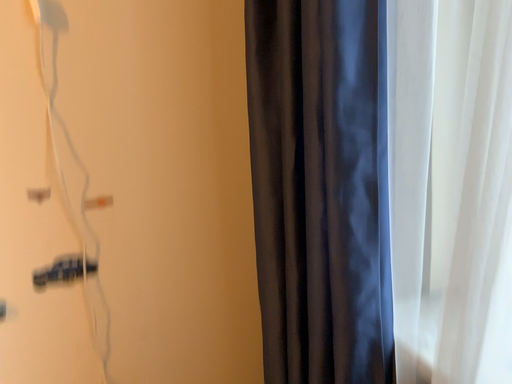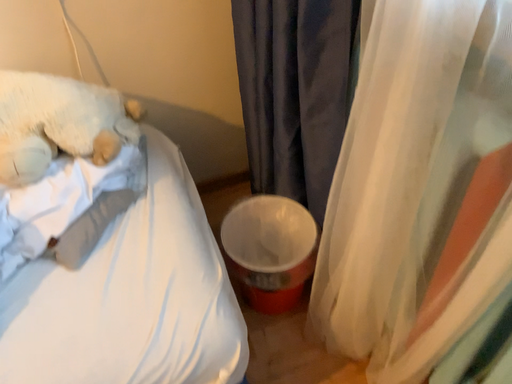
Question: Which way did the camera rotate in the video?

Choices:
 (A) rotated downward
 (B) rotated upward

Answer: (A)